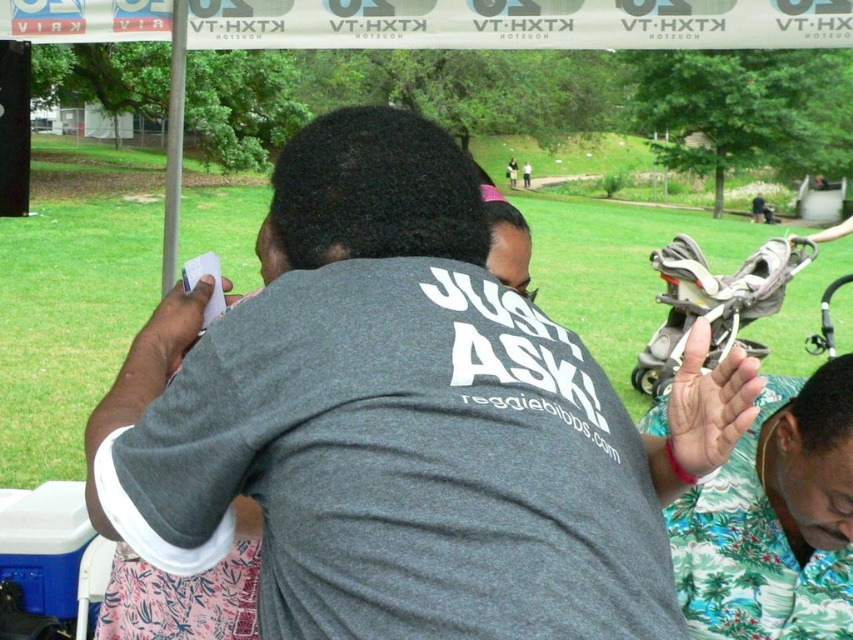
You are a photographer at the event and want to capture both the green floral shirt at lower right and the white fabric canopy at upper center in a single shot. Considering their sizes, which object should you focus on first to ensure both are in frame?

The green floral shirt at lower right has a smaller size compared to the white fabric canopy at upper center. To ensure both are in frame, focus on the larger white fabric canopy at upper center first, then adjust the camera angle to include the smaller green floral shirt at lower right.